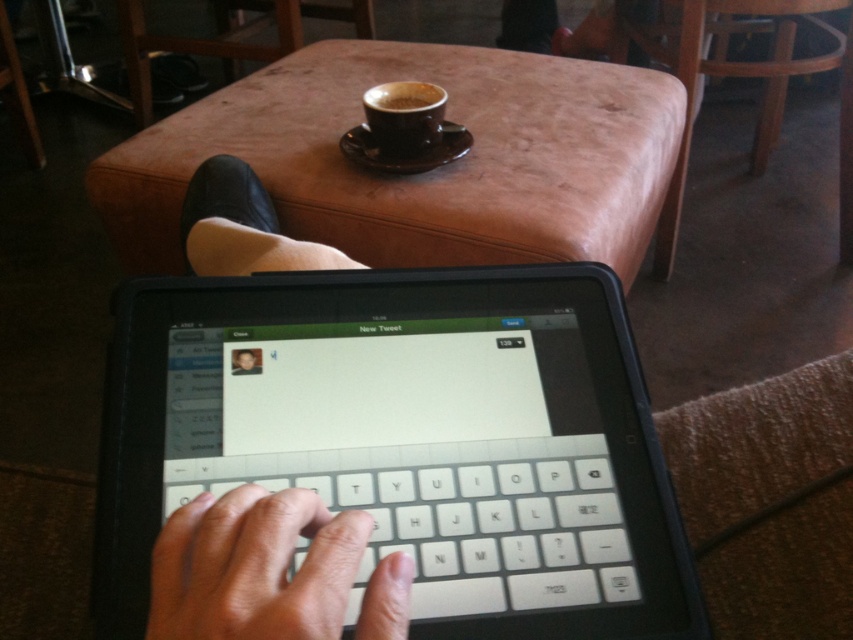
You are a photographer taking a portrait of the person in the image. You want to ensure both the light skin tone finger at center and the smooth skin face at center are clearly visible in the photo. Based on their positions, which one should you focus on first to ensure proper depth of field?

The light skin tone finger at center is located below the smooth skin face at center, so focusing on the smooth skin face at center first will ensure both are in focus due to its higher position.

You are a barista in a coffee shop. A customer is sitting in front of you with a tablet on their lap. You notice their light skin tone finger at center and a black ceramic cup at upper center. Can you hand them the cup without touching their tablet?

The light skin tone finger at center is in front of the black ceramic cup at upper center, meaning the cup is behind the finger. Since the finger is closer to you, you can safely hand them the cup without touching the tablet.

Based on the scene described, can the light skin tone finger at center fit entirely within the smooth skin face at center?

The light skin tone finger at center might be wider than smooth skin face at center, so it might not fit entirely within it.